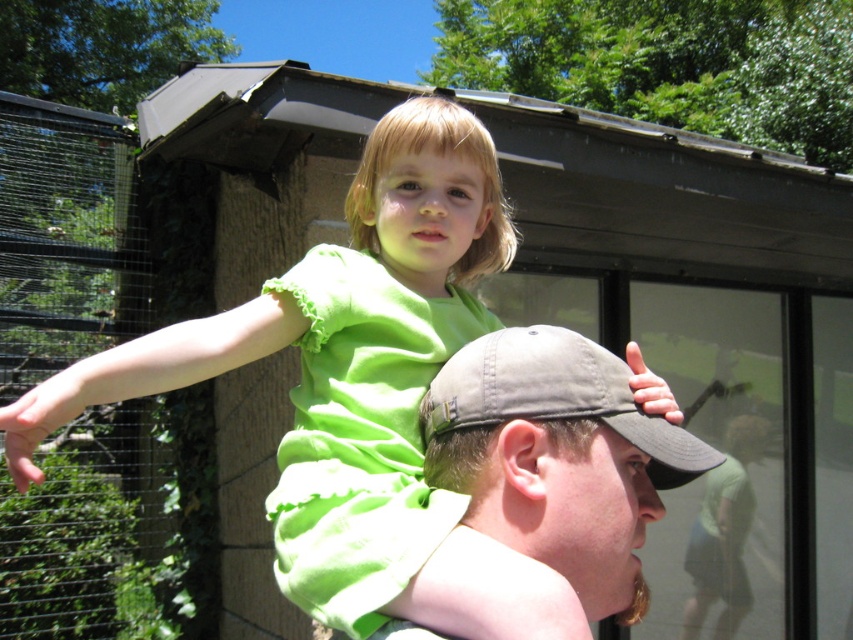
You are a photographer trying to capture a clear shot of the green matte dress at upper center and the khaki fabric baseball cap at upper center. Based on their positions, which object should you focus on first to ensure both are in frame without moving the camera?

The green matte dress at upper center is much taller than the khaki fabric baseball cap at upper center, so you should focus on the green matte dress at upper center first to ensure it fits within the frame, as it occupies more vertical space.

You are standing at the point labeled point [660,419] and want to walk to the point labeled point [693,580]. Which direction should you face to walk towards your destination?

You should face towards the direction of point [693,580], which is behind point [660,419] according to their spatial relationship.